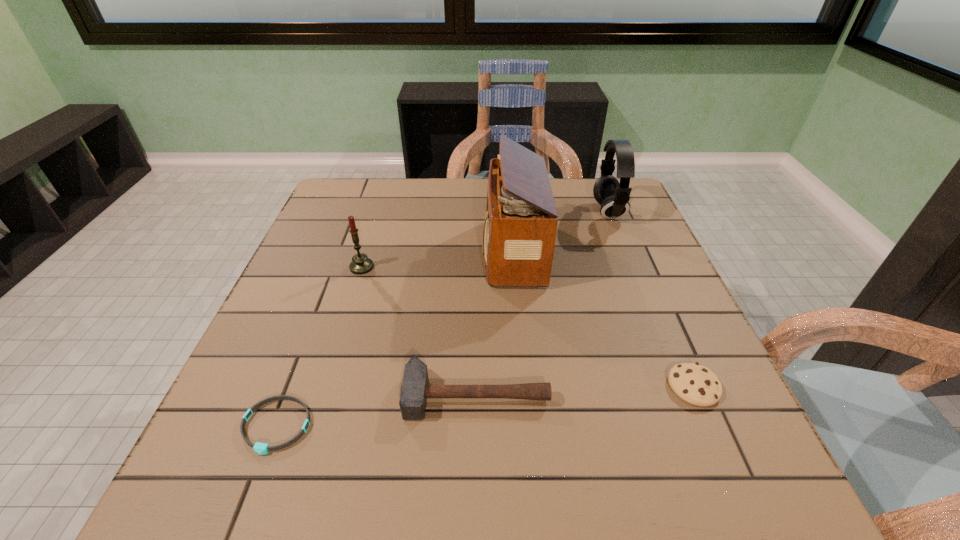
Select which object is the third closest to the radio receiver. Please provide its 2D coordinates. Your answer should be formatted as a tuple, i.e. [(x, y)], where the tuple contains the x and y coordinates of a point satisfying the conditions above.

[(361, 264)]

Image resolution: width=960 pixels, height=540 pixels. What are the coordinates of `object that stands as the closest to the shortest object` in the screenshot? It's located at (415, 389).

Where is `vacant position in the image that satisfies the following two spatial constraints: 1. on the front panel of the radio receiver; 2. on the left side of the fifth tallest object`? Image resolution: width=960 pixels, height=540 pixels. vacant position in the image that satisfies the following two spatial constraints: 1. on the front panel of the radio receiver; 2. on the left side of the fifth tallest object is located at coordinates (525, 387).

The height and width of the screenshot is (540, 960). In order to click on free location that satisfies the following two spatial constraints: 1. on the front panel of the tallest object; 2. on the back side of the second shortest object in this screenshot , I will do `click(525, 387)`.

Locate an element on the screen. The image size is (960, 540). free spot that satisfies the following two spatial constraints: 1. on the front panel of the radio receiver; 2. on the striking surface of the fourth tallest object is located at coordinates (526, 394).

Image resolution: width=960 pixels, height=540 pixels. What are the coordinates of `free region that satisfies the following two spatial constraints: 1. on the back side of the cookie; 2. on the ear cups of the fifth shortest object` in the screenshot? It's located at (617, 211).

At what (x,y) coordinates should I click in order to perform the action: click on vacant region that satisfies the following two spatial constraints: 1. on the front panel of the tallest object; 2. on the buckle of the wristband. Please return your answer as a coordinate pair (x, y). Image resolution: width=960 pixels, height=540 pixels. Looking at the image, I should click on coord(529,426).